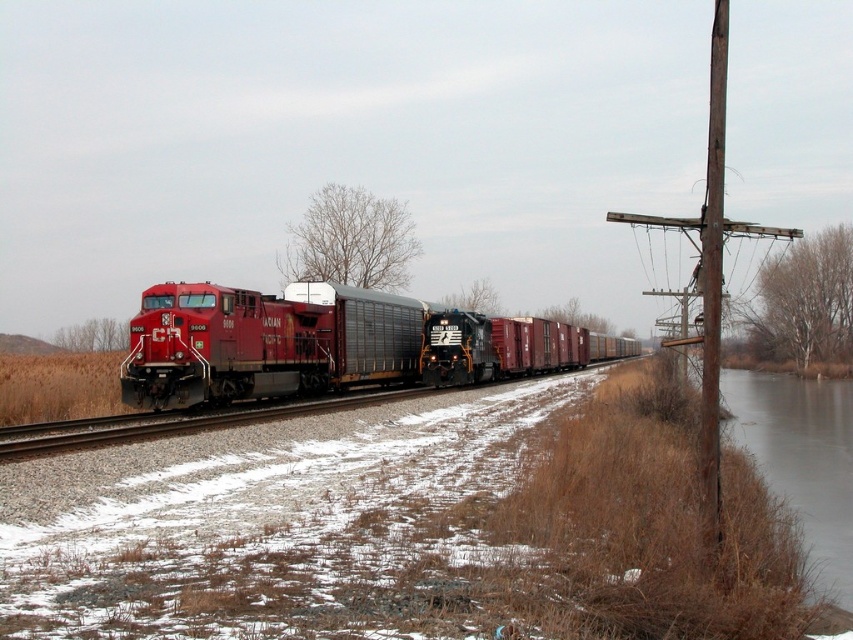
Question: Among these objects, which one is farthest from the camera?

Choices:
 (A) brown wooden telegraph pole at right
 (B) brown wooden pole at right

Answer: (B)

Question: Which point is farther from the camera taking this photo?

Choices:
 (A) (165, 378)
 (B) (717, 486)

Answer: (A)

Question: Does brown wooden telegraph pole at right come behind brown wooden pole at right?

Choices:
 (A) yes
 (B) no

Answer: (B)

Question: Is matte red locomotive at center below brown wooden pole at right?

Choices:
 (A) yes
 (B) no

Answer: (A)

Question: Can you confirm if matte red locomotive at center is positioned above brown wooden pole at right?

Choices:
 (A) yes
 (B) no

Answer: (B)

Question: Among these objects, which one is nearest to the camera?

Choices:
 (A) brown wooden pole at right
 (B) matte red locomotive at center
 (C) brown wooden telegraph pole at right

Answer: (C)